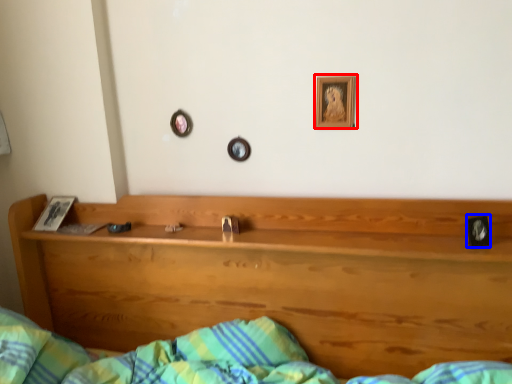
Question: Which object is further to the camera taking this photo, picture frame (highlighted by a red box) or picture frame (highlighted by a blue box)?

Choices:
 (A) picture frame
 (B) picture frame

Answer: (A)